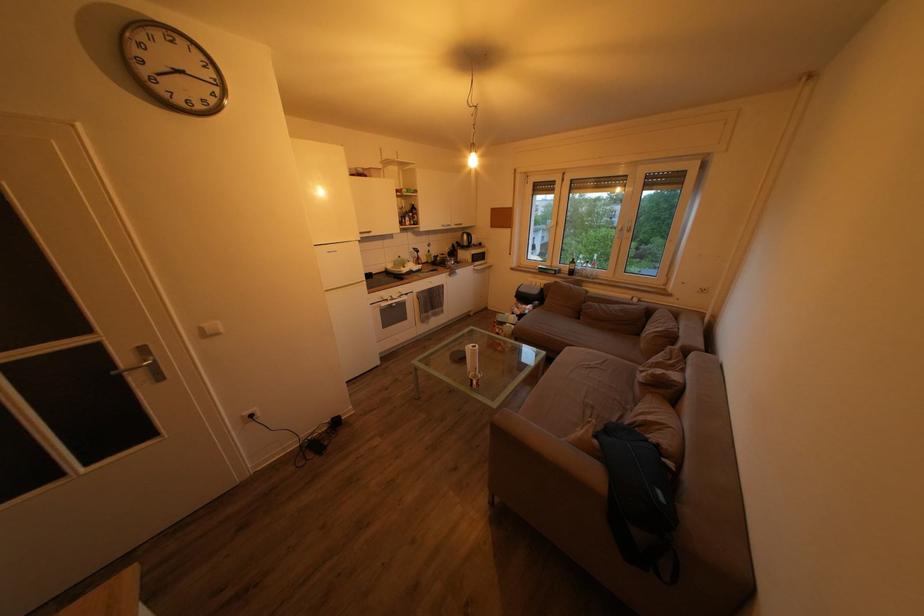
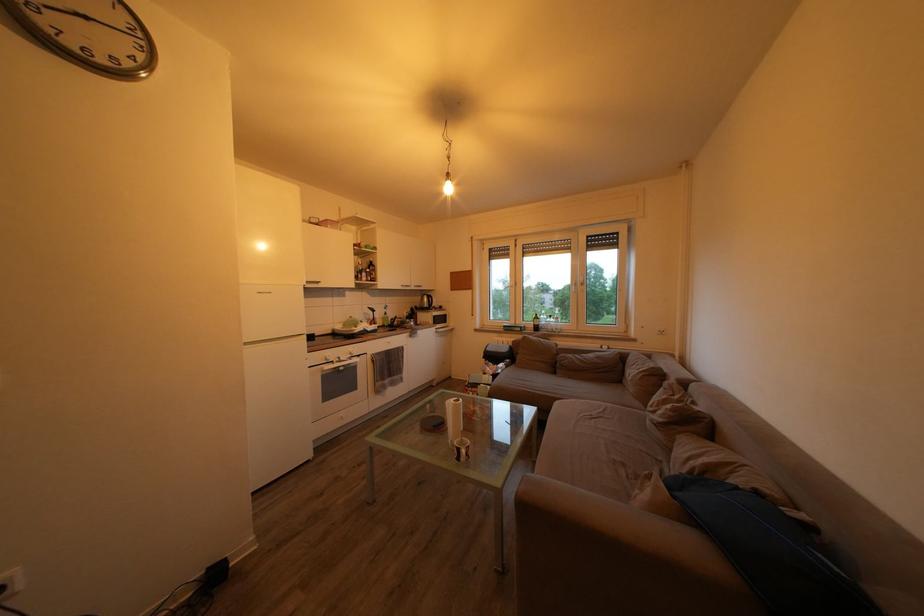
In the second image, find the point that corresponds to (x=397, y=273) in the first image.

(346, 333)